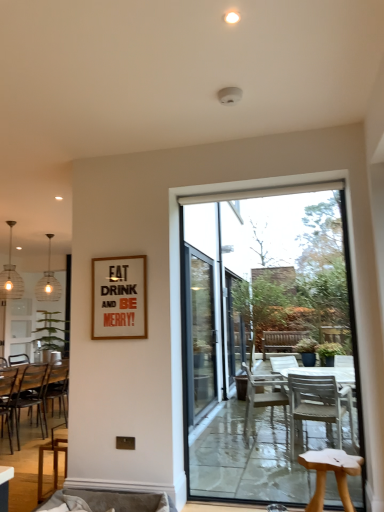
Question: From the image's perspective, is matte glass pendant light at left, the 1th lamp when ordered from front to back, located above or below wooden chair at left, marked as the second chair in a back-to-front arrangement?

Choices:
 (A) above
 (B) below

Answer: (A)

Question: Is matte glass pendant light at left, positioned as the 2th lamp in back-to-front order, in front of or behind wooden chair at left, placed as the second chair when sorted from front to back, in the image?

Choices:
 (A) behind
 (B) front

Answer: (A)

Question: Based on their relative distances, which object is farther from the wooden frame at upper center?

Choices:
 (A) transparent glass door at center
 (B) wooden chair at lower left, the first chair positioned from the right
 (C) velvet beige couch at lower center
 (D) clear glass pendant light at left, which appears as the first lamp when viewed from the back
 (E) wooden chair at left, which is counted as the first chair, starting from the left

Answer: (D)

Question: Estimate the real-world distances between objects in this image. Which object is closer to the clear glass pendant light at left, which ranks as the second lamp in front-to-back order?

Choices:
 (A) transparent glass door at center
 (B) wooden chair at lower left, the first chair positioned from the right
 (C) wooden chair at left, the 3th chair in the right-to-left sequence
 (D) wooden chair at left, the 3th chair positioned from the front
 (E) green leafy plant at left

Answer: (E)